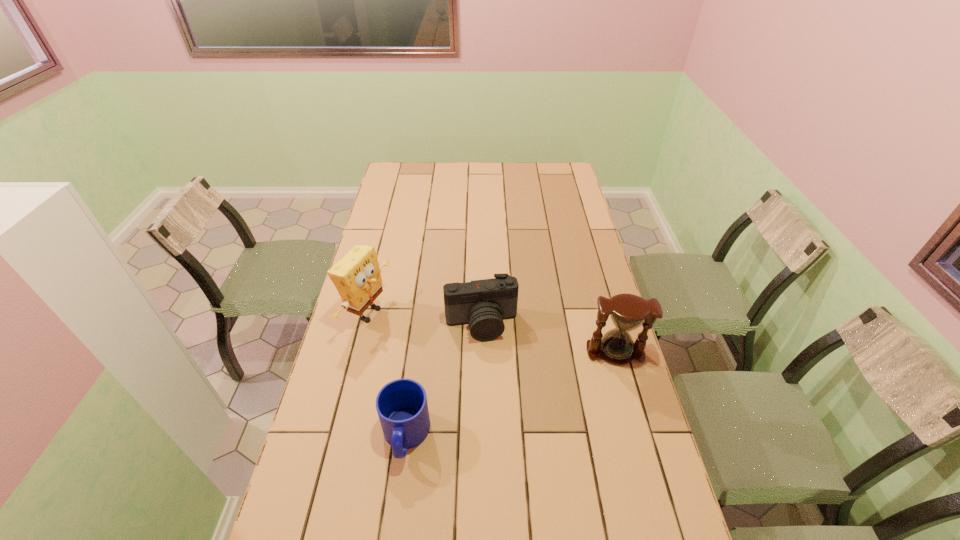
Find the location of a particular element. free location located 0.400m at the lens of the third object from left to right is located at coordinates (514, 465).

You are a GUI agent. You are given a task and a screenshot of the screen. Output one action in this format:
    pyautogui.click(x=<x>, y=<y>)
    Task: Click on the free spot located 0.250m on the face of the leftmost object
    The height and width of the screenshot is (540, 960).
    Given the screenshot: What is the action you would take?
    pyautogui.click(x=451, y=352)

Where is `vacant region located 0.370m on the face of the leftmost object`? The width and height of the screenshot is (960, 540). vacant region located 0.370m on the face of the leftmost object is located at coordinates (486, 366).

Where is `vacant space located 0.270m on the face of the leftmost object`? The image size is (960, 540). vacant space located 0.270m on the face of the leftmost object is located at coordinates (456, 354).

This screenshot has width=960, height=540. In order to click on object situated at the left edge in this screenshot , I will do `click(357, 277)`.

The height and width of the screenshot is (540, 960). In order to click on object that is at the right edge in this screenshot , I will do `click(628, 312)`.

At what (x,y) coordinates should I click in order to perform the action: click on vacant area at the far edge of the desktop. Please return your answer as a coordinate pair (x, y). Image resolution: width=960 pixels, height=540 pixels. Looking at the image, I should click on (506, 164).

What are the coordinates of `vacant area at the near edge of the desktop` in the screenshot? It's located at (365, 539).

You are a GUI agent. You are given a task and a screenshot of the screen. Output one action in this format:
    pyautogui.click(x=<x>, y=<y>)
    Task: Click on the free point at the left edge
    
    Given the screenshot: What is the action you would take?
    pyautogui.click(x=310, y=490)

The height and width of the screenshot is (540, 960). In the image, there is a desktop. Identify the location of free space at the right edge. (609, 389).